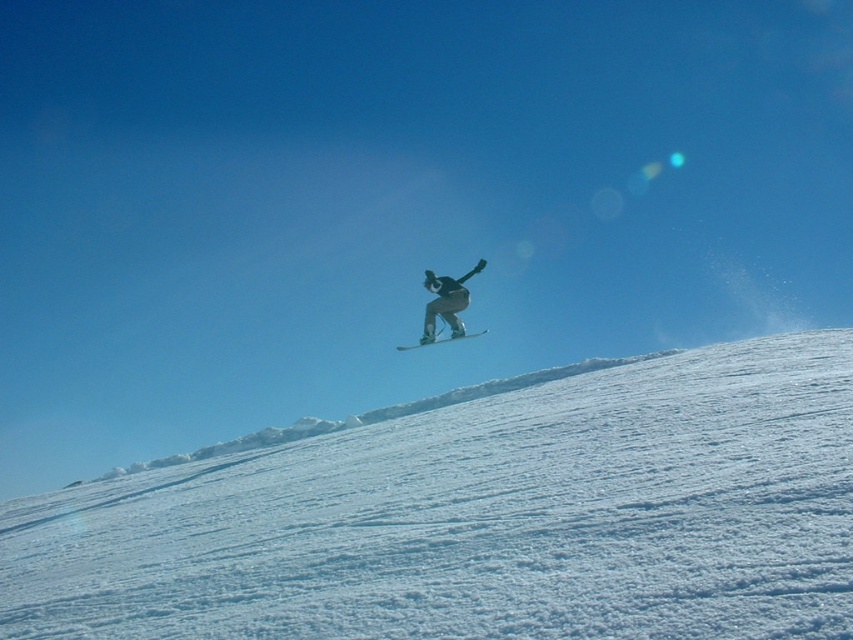
Question: Does white powdery snow at center have a smaller size compared to black matte snowboarder at center?

Choices:
 (A) no
 (B) yes

Answer: (A)

Question: Where is black matte snowboarder at center located in relation to white matte snowboard at center in the image?

Choices:
 (A) right
 (B) left

Answer: (A)

Question: Estimate the real-world distances between objects in this image. Which object is farther from the white powdery snow at center?

Choices:
 (A) white matte snowboard at center
 (B) black matte snowboarder at center

Answer: (B)

Question: Which point is farther from the camera taking this photo?

Choices:
 (A) (447, 339)
 (B) (485, 332)

Answer: (B)

Question: Can you confirm if white powdery snow at center is positioned to the left of white matte snowboard at center?

Choices:
 (A) no
 (B) yes

Answer: (B)

Question: Which object is the closest to the white powdery snow at center?

Choices:
 (A) white matte snowboard at center
 (B) black matte snowboarder at center

Answer: (A)